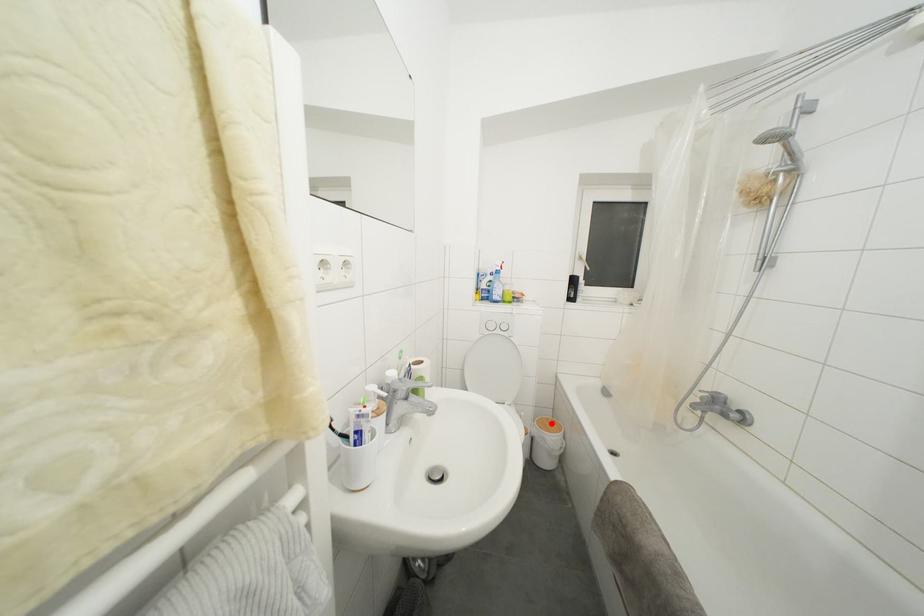
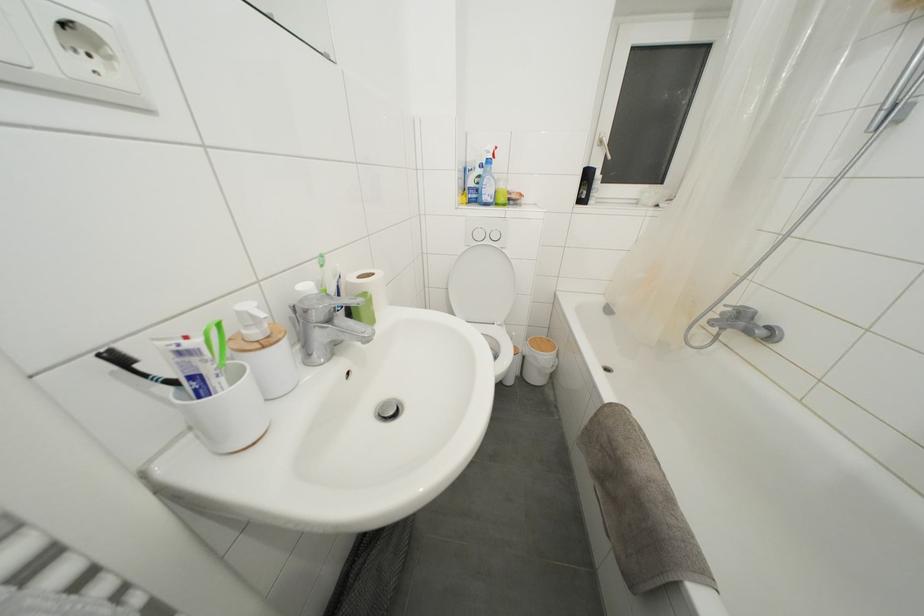
Question: I am providing you with two images of the same scene from different viewpoints. A red point is shown in image1. For the corresponding object point in image2, is it positioned nearer or farther from the camera?

Choices:
 (A) Nearer
 (B) Farther

Answer: (A)